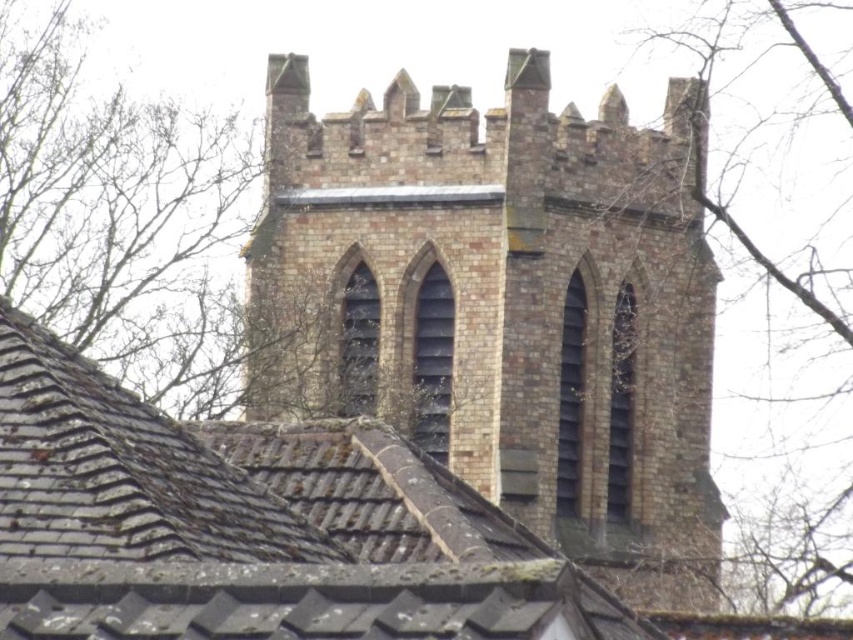
Question: Does brown brick church at center have a greater width compared to brown tile roof at upper center?

Choices:
 (A) no
 (B) yes

Answer: (B)

Question: Which object is farther from the camera taking this photo?

Choices:
 (A) brown textured stone tower at upper center
 (B) brown brick church at center

Answer: (A)

Question: Is brown brick church at center to the left of brown textured stone tower at upper center from the viewer's perspective?

Choices:
 (A) no
 (B) yes

Answer: (B)

Question: Which object is positioned farthest from the brown textured stone tower at upper center?

Choices:
 (A) brown brick church at center
 (B) brown tile roof at upper center
 (C) bare branches at upper left

Answer: (B)

Question: Does brown brick church at center appear under bare branches at upper left?

Choices:
 (A) no
 (B) yes

Answer: (B)

Question: Which object appears farthest from the camera in this image?

Choices:
 (A) brown textured stone tower at upper center
 (B) brown tile roof at upper center
 (C) brown brick church at center
 (D) bare branches at upper left

Answer: (D)